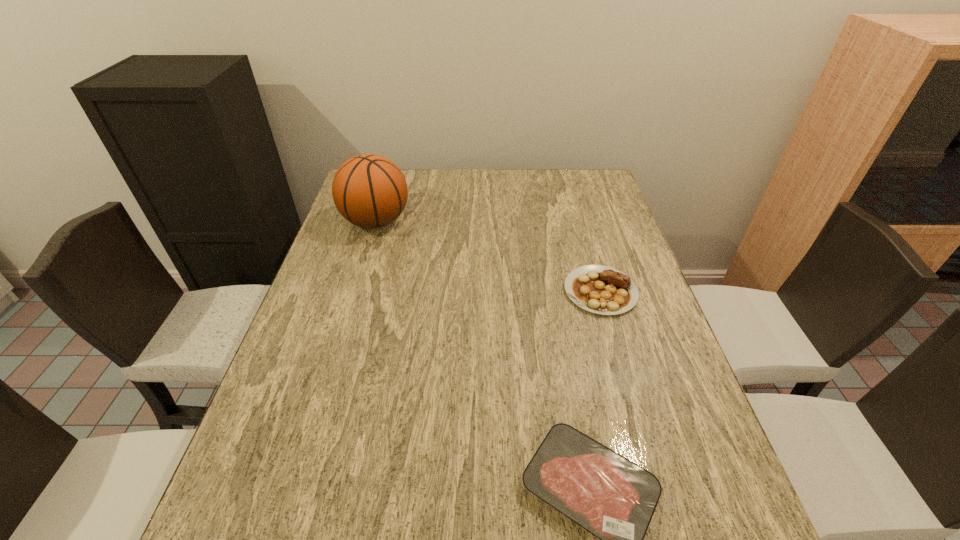
In order to click on free spot that satisfies the following two spatial constraints: 1. on the front side of the basketball; 2. on the left side of the second tallest object in this screenshot , I will do `click(354, 291)`.

This screenshot has width=960, height=540. In order to click on free space that satisfies the following two spatial constraints: 1. on the front side of the taller steak; 2. on the left side of the tallest object in this screenshot , I will do `click(354, 291)`.